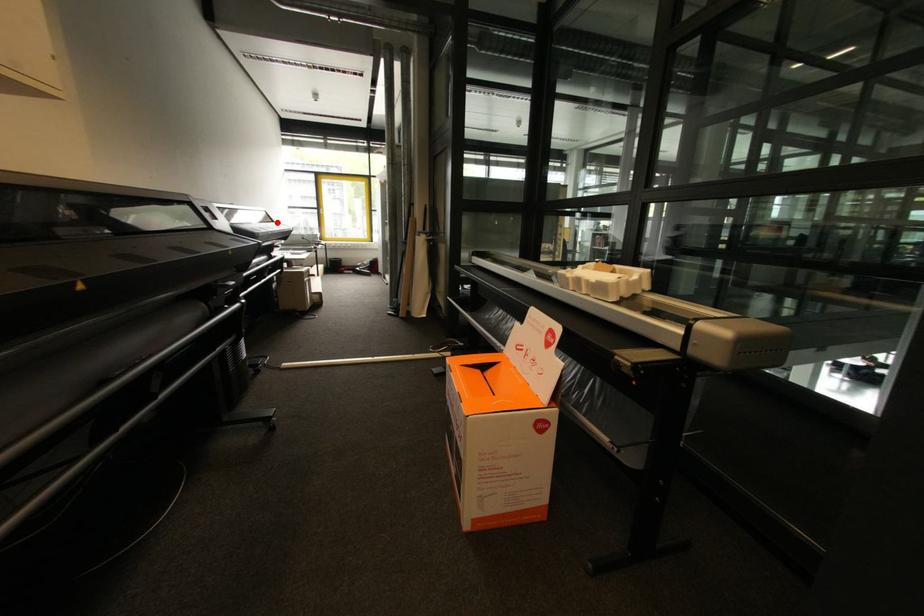
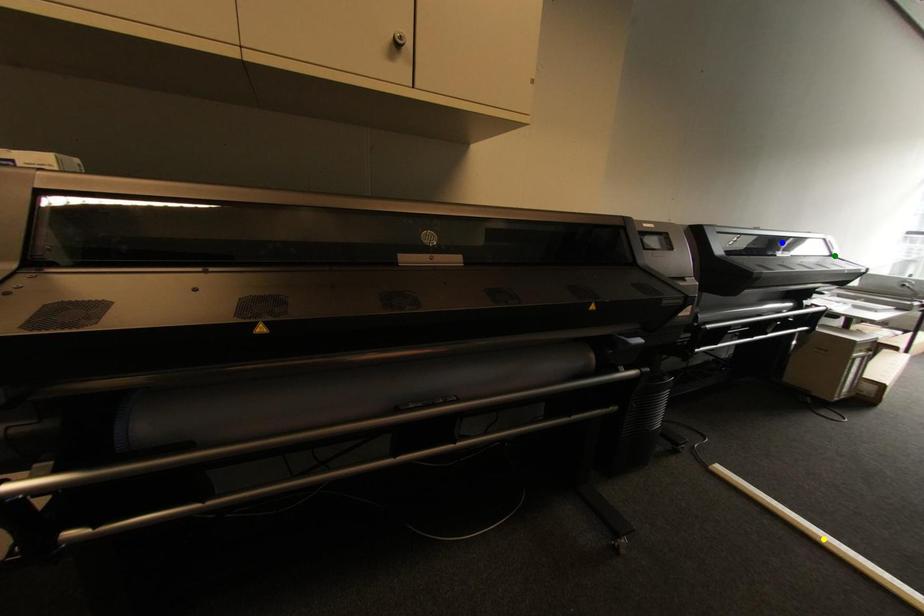
Question: I am providing you with two images of the same scene from different viewpoints. A red point is marked on the first image. You are given multiple points on the second image. Can you choose the point in image 2 that corresponds to the point in image 1?

Choices:
 (A) yellow point
 (B) blue point
 (C) green point

Answer: (C)